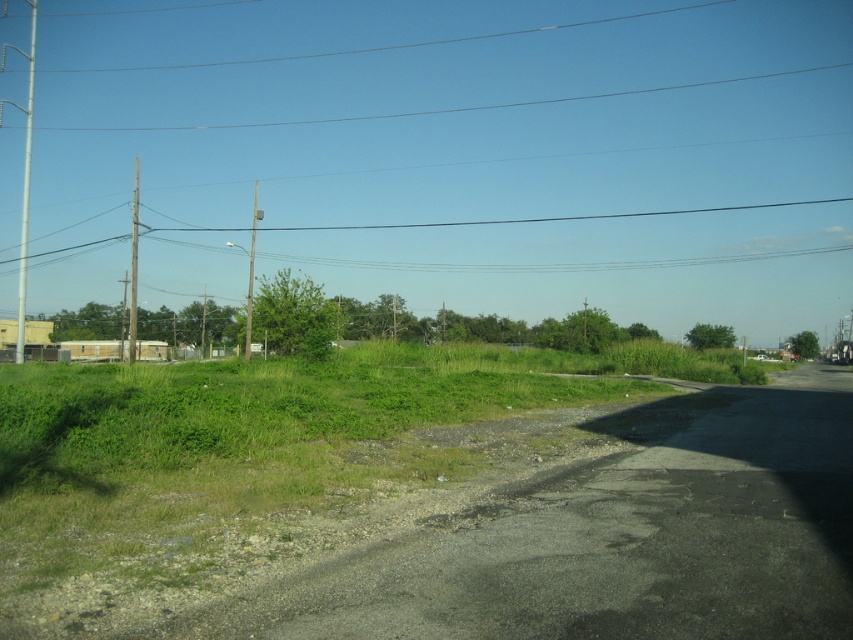
Is silver metallic pole at left bigger than smooth gray pole at center?

Correct, silver metallic pole at left is larger in size than smooth gray pole at center.

Does silver metallic pole at left have a lesser height compared to smooth gray pole at center?

Incorrect, silver metallic pole at left's height does not fall short of smooth gray pole at center's.

Describe the element at coordinates (26, 186) in the screenshot. I see `silver metallic pole at left` at that location.

This screenshot has height=640, width=853. What are the coordinates of `silver metallic pole at left` in the screenshot? It's located at (26, 186).

Can you confirm if silver metallic pole at left is shorter than wooden telegraph pole at left?

No.

Can you confirm if silver metallic pole at left is wider than wooden telegraph pole at left?

Indeed, silver metallic pole at left has a greater width compared to wooden telegraph pole at left.

Identify the location of silver metallic pole at left. Image resolution: width=853 pixels, height=640 pixels. (26, 186).

Does wooden telegraph pole at left have a greater height compared to smooth gray pole at center?

Indeed, wooden telegraph pole at left has a greater height compared to smooth gray pole at center.

How distant is wooden telegraph pole at left from smooth gray pole at center?

wooden telegraph pole at left and smooth gray pole at center are 14.57 meters apart from each other.

Is point (132, 317) behind point (254, 180)?

That is False.

The image size is (853, 640). Find the location of `wooden telegraph pole at left`. wooden telegraph pole at left is located at coordinates (132, 266).